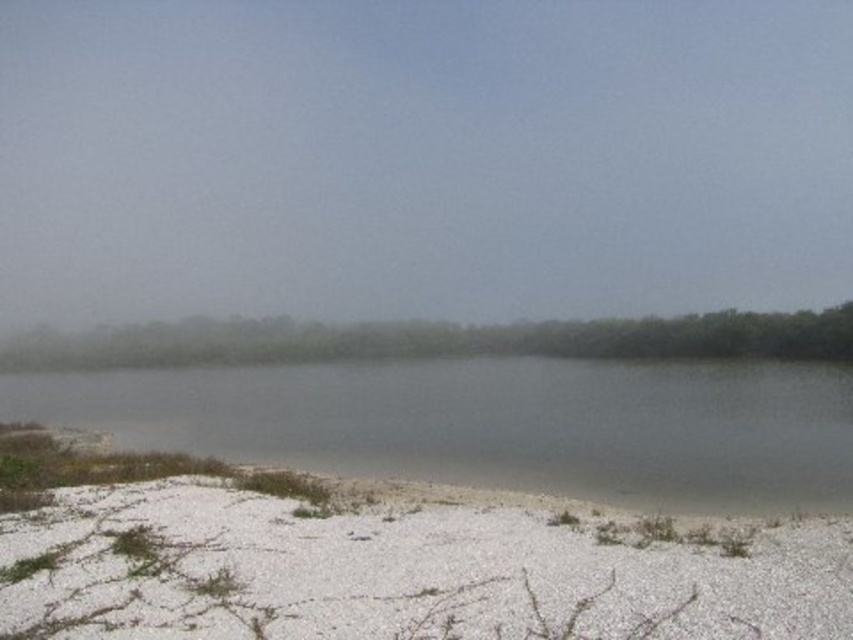
You are a hiker who needs to cross from the white gravelly sand at lower left to the gray matte lake at center. The path between them is 31.63 meters. If your backpack weighs 15 kg and you can carry an additional 10 kg, can you safely carry a 5 kg water container and make the crossing?

The distance between the white gravelly sand at lower left and gray matte lake at center is 31.63 meters. Since your backpack weighs 15 kg and you can carry an additional 10 kg, adding a 5 kg water container keeps your total load at 20 kg, which is within your capacity. Therefore, you can safely carry the water container and cross the 31.63 meters between the two locations.

You are planning to take a photo of the white gravelly sand at lower left and the foggy haze at upper center. Which object is wider in the image?

The foggy haze at upper center might be wider than white gravelly sand at lower left.

You are an explorer in this landscape and want to take a photo of the foggy haze at upper center and the gray matte lake at center. Which object should you point your camera towards first if you want to capture both in one shot?

You should point your camera towards the gray matte lake at center first because the foggy haze at upper center is to the right of it, allowing both to be captured in the same frame.